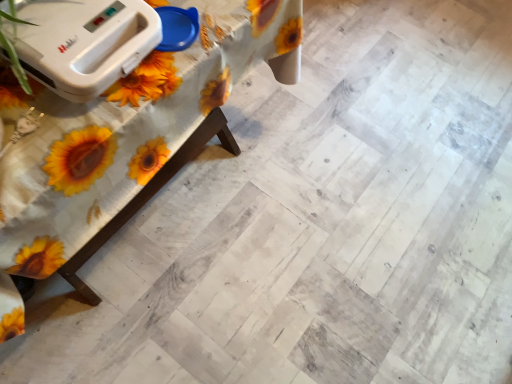
This screenshot has height=384, width=512. I want to click on vacant area that is in front of white plastic toaster at upper left, so click(50, 136).